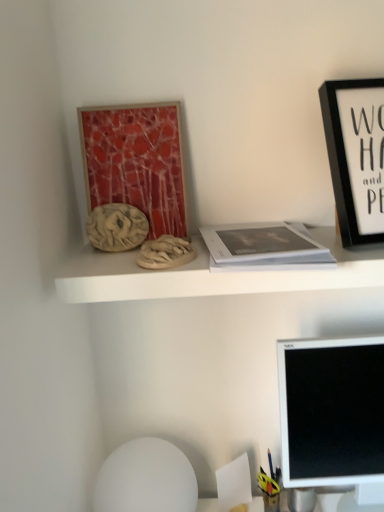
Question: From a real-world perspective, is white matte book at center physically located above or below matte red mosaic art at upper left?

Choices:
 (A) above
 (B) below

Answer: (B)

Question: Is white matte book at center to the left or to the right of matte red mosaic art at upper left in the image?

Choices:
 (A) right
 (B) left

Answer: (A)

Question: Estimate the real-world distances between objects in this image. Which object is farther from the white matte sphere at lower center?

Choices:
 (A) matte red mosaic art at upper left
 (B) white glossy computer monitor at lower right
 (C) matte wood shelf at upper center
 (D) matte clay sculpture at upper left
 (E) white matte book at center

Answer: (A)

Question: Estimate the real-world distances between objects in this image. Which object is closer to the matte red mosaic art at upper left?

Choices:
 (A) white glossy computer monitor at lower right
 (B) white matte book at center
 (C) black matte picture frame at upper right
 (D) matte clay sculpture at upper left
 (E) matte wood shelf at upper center

Answer: (D)